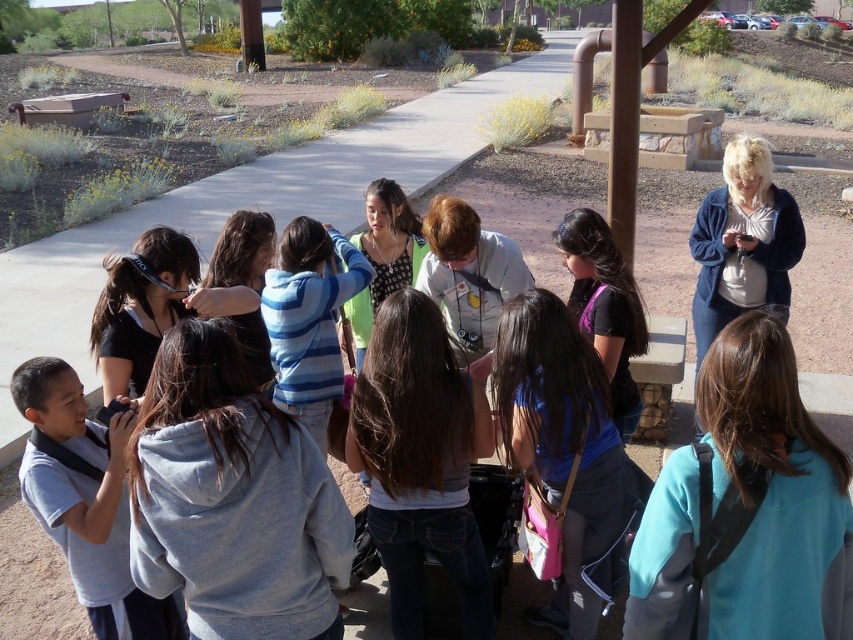
You are a photographer trying to capture a group photo of the white cotton shirt at upper right and the light brown hair at center. Since you want to ensure both subjects are fully visible, which subject requires more space in the frame horizontally?

The white cotton shirt at upper right requires more space in the frame horizontally because its width surpasses that of the light brown hair at center.

Looking at this image, you are a photographer trying to capture a photo of the light brown hair at center without the white cotton shirt at upper right blocking it. What should you do?

Move the camera to the left so that the light brown hair at center is no longer behind the white cotton shirt at upper right.